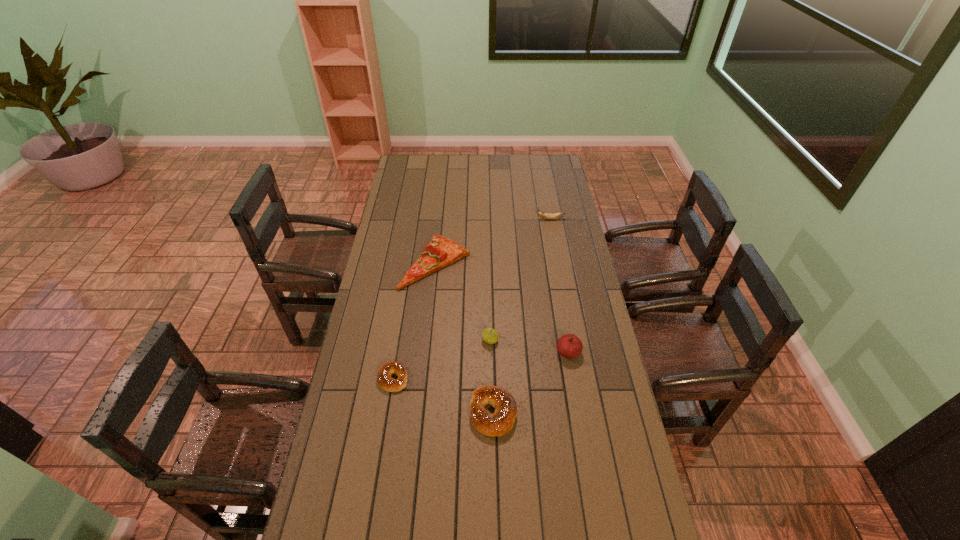
Find the location of a particular element. free space located on the front of the right bagel is located at coordinates (495, 501).

The height and width of the screenshot is (540, 960). I want to click on free space located on the peel of the banana, so (x=497, y=219).

In order to click on free space located 0.320m on the peel of the banana in this screenshot , I will do `click(469, 219)`.

Image resolution: width=960 pixels, height=540 pixels. In order to click on vacant region located 0.160m on the peel of the banana in this screenshot , I will do `click(503, 219)`.

The height and width of the screenshot is (540, 960). I want to click on vacant region located 0.310m on the back of the tomato, so click(556, 281).

The image size is (960, 540). Identify the location of vacant space located 0.340m on the front of the pizza. (425, 361).

Image resolution: width=960 pixels, height=540 pixels. What are the coordinates of `vacant region located on the front of the pear` in the screenshot? It's located at (492, 425).

This screenshot has height=540, width=960. Identify the location of bagel present at the left edge. (384, 378).

The width and height of the screenshot is (960, 540). What are the coordinates of `pizza at the left edge` in the screenshot? It's located at (440, 252).

This screenshot has height=540, width=960. What are the coordinates of `banana situated at the right edge` in the screenshot? It's located at (543, 215).